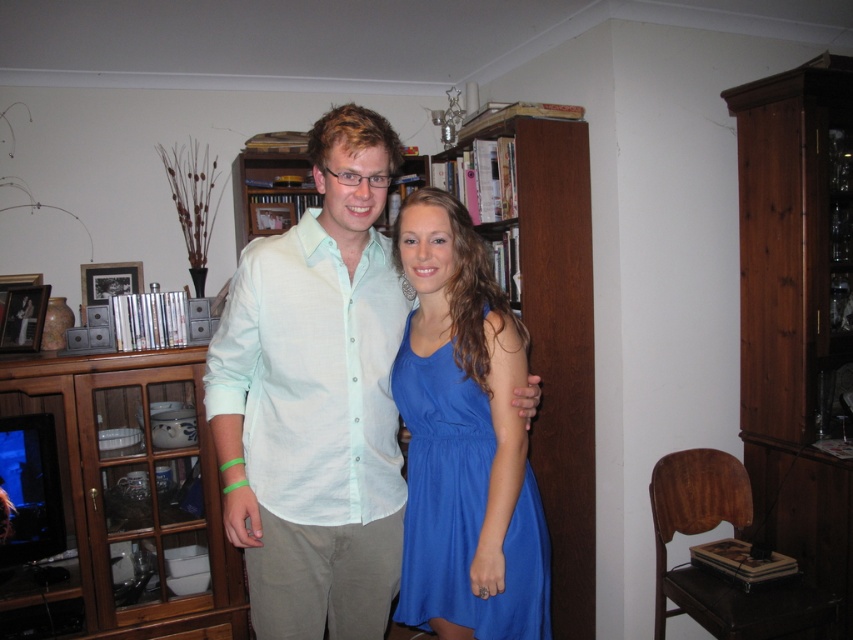
Question: Does wooden cabinet at left have a larger size compared to wooden bookshelf at center?

Choices:
 (A) yes
 (B) no

Answer: (B)

Question: Which of the following is the farthest from the observer?

Choices:
 (A) blue satin dress at center
 (B) wooden bookshelf at center
 (C) wooden cabinet at left
 (D) light green cotton shirt at center

Answer: (B)

Question: Can you confirm if wooden cabinet at left is wider than blue satin dress at center?

Choices:
 (A) yes
 (B) no

Answer: (A)

Question: Considering the real-world distances, which object is closest to the wooden cabinet at left?

Choices:
 (A) blue satin dress at center
 (B) wooden bookshelf at center
 (C) light green cotton shirt at center

Answer: (C)

Question: Estimate the real-world distances between objects in this image. Which object is closer to the blue satin dress at center?

Choices:
 (A) wooden bookshelf at center
 (B) wooden cabinet at left
 (C) light green cotton shirt at center

Answer: (C)

Question: Is the position of wooden cabinet at left more distant than that of wooden bookshelf at center?

Choices:
 (A) no
 (B) yes

Answer: (A)